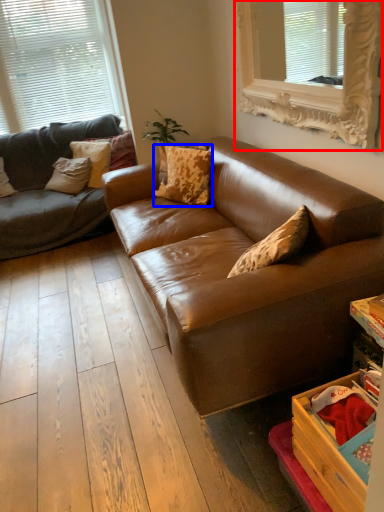
Question: Which object appears closest to the camera in this image, window (highlighted by a red box) or pillow (highlighted by a blue box)?

Choices:
 (A) window
 (B) pillow

Answer: (A)